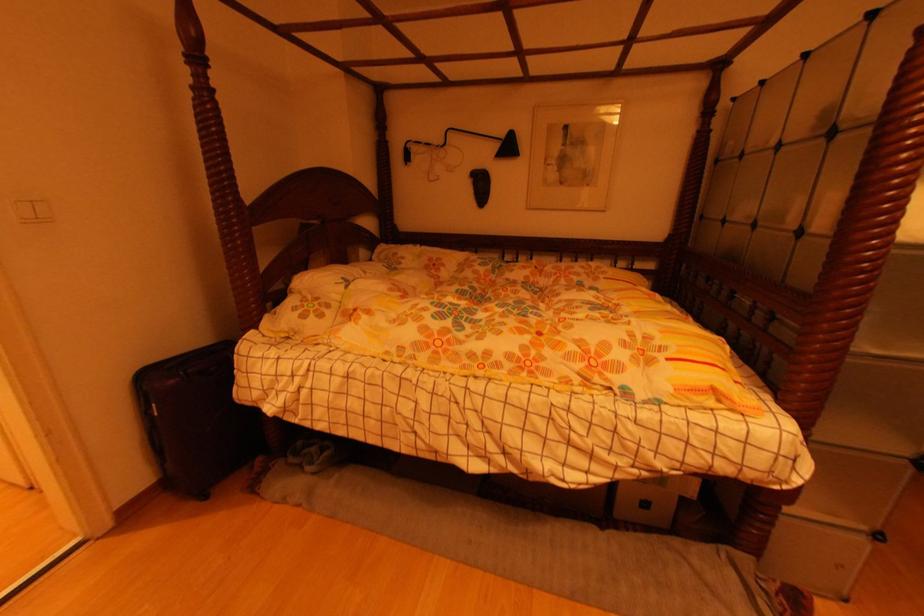
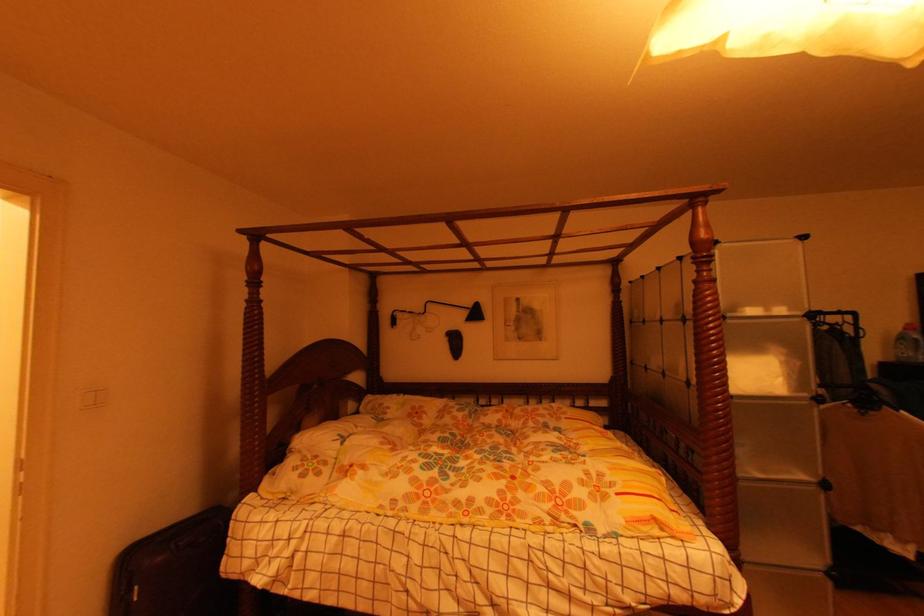
Question: What movement of the cameraman would produce the second image?

Choices:
 (A) Left
 (B) Right
 (C) Forward
 (D) Backward

Answer: (D)